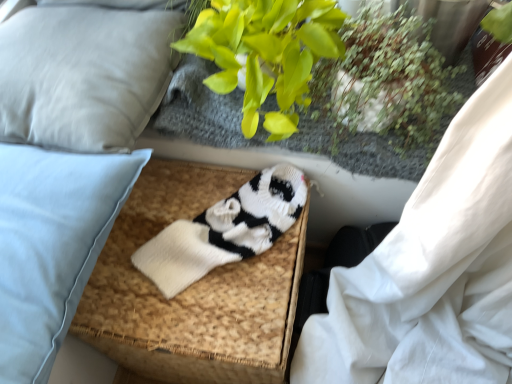
Question: From the image's perspective, relative to light gray fabric pillow at upper left, acting as the 1th pillow starting from the top, is white knitted footrest at center above or below?

Choices:
 (A) above
 (B) below

Answer: (B)

Question: In the image, is white knitted footrest at center on the left side or the right side of light gray fabric pillow at upper left, acting as the 1th pillow starting from the top?

Choices:
 (A) left
 (B) right

Answer: (B)

Question: Which object is positioned closest to the green leafy plant at upper right?

Choices:
 (A) light blue fabric pillow at left, positioned as the 1th pillow in bottom-to-top order
 (B) light gray fabric pillow at upper left, acting as the 1th pillow starting from the top
 (C) green leafy plant at upper center
 (D) white knitted footrest at center

Answer: (C)

Question: Which of these objects is positioned farthest from the green leafy plant at upper right?

Choices:
 (A) white knitted footrest at center
 (B) light blue fabric pillow at left, positioned as the 1th pillow in bottom-to-top order
 (C) light gray fabric pillow at upper left, acting as the 1th pillow starting from the top
 (D) green leafy plant at upper center

Answer: (B)